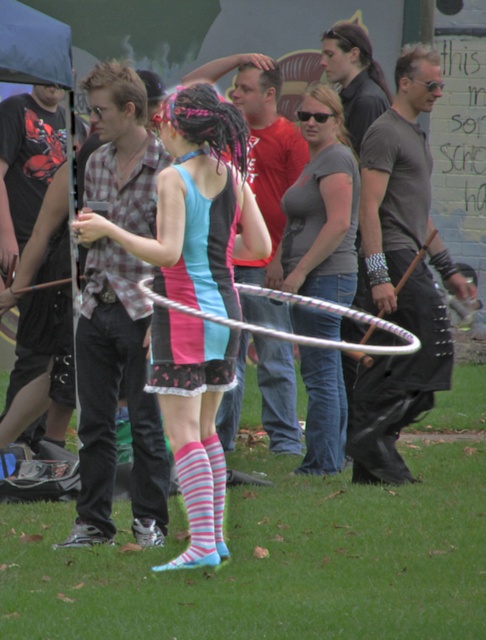
You are standing in the festival crowd and want to move from point (x=328, y=134) to point (x=326, y=390). Which direction should you move to get closer to the hula hoop?

Since point (x=328, y=134) is closer to the viewer than point (x=326, y=390), you should move towards the direction away from the viewer to reach the latter point. However, the hula hoop is in the center of the frame, so moving towards it would mean heading toward the center. If both points are on the same horizontal plane, you might need to adjust your position laterally or check the path for obstructions.